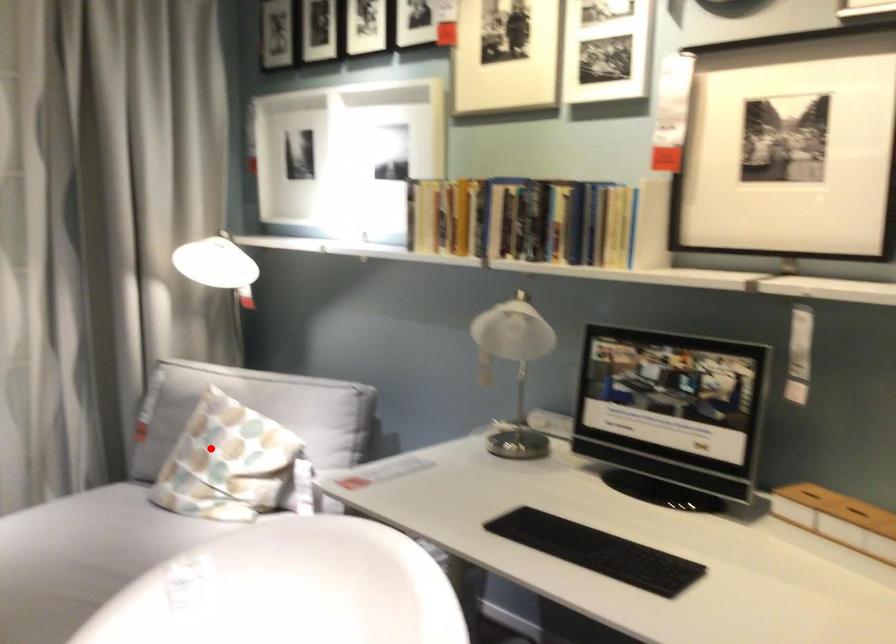
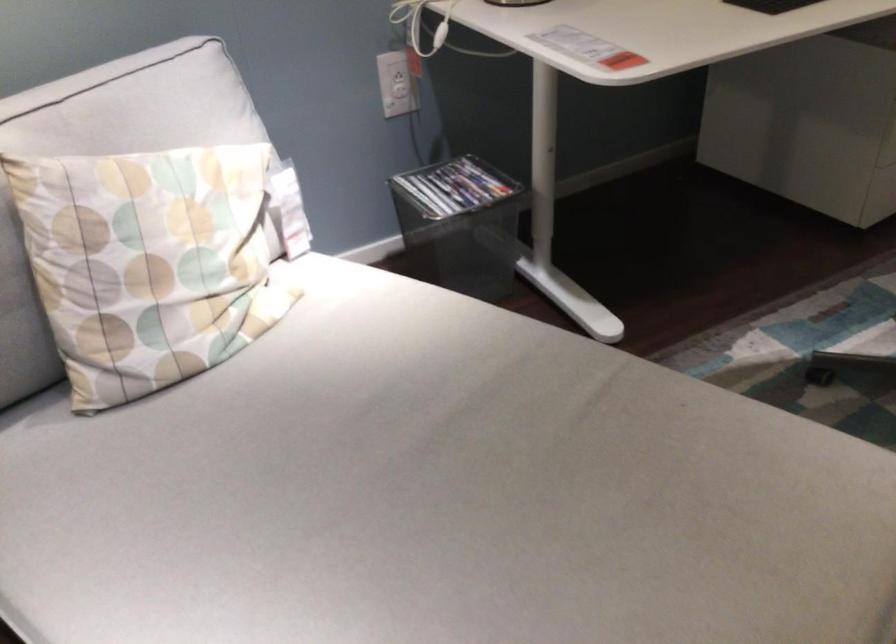
Locate, in the second image, the point that corresponds to the highlighted location in the first image.

(149, 263)